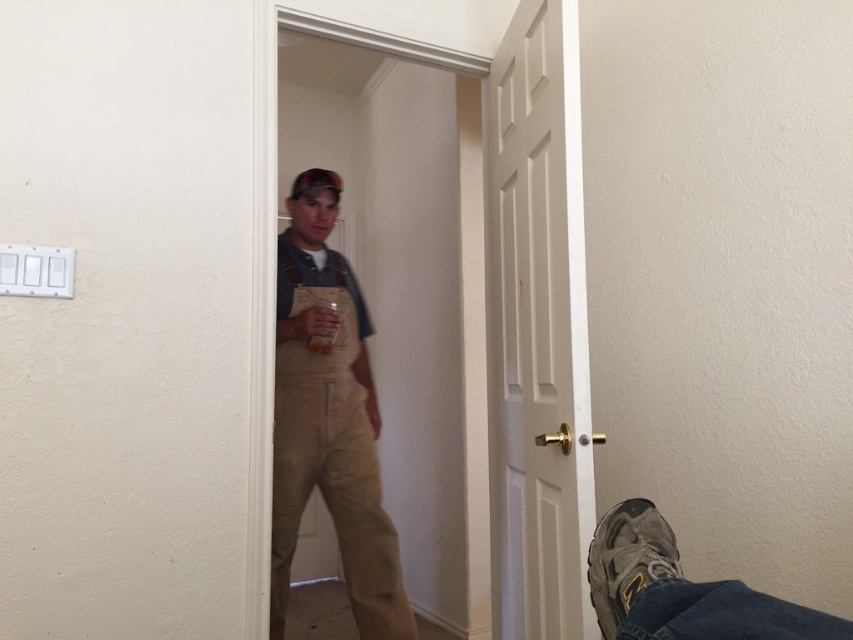
Looking at this image, is khaki overalls at center below brown suede shoe at lower right?

No, khaki overalls at center is not below brown suede shoe at lower right.

Can you confirm if khaki overalls at center is taller than brown suede shoe at lower right?

Yes, khaki overalls at center is taller than brown suede shoe at lower right.

Where is `khaki overalls at center`? Image resolution: width=853 pixels, height=640 pixels. khaki overalls at center is located at coordinates (328, 419).

Where is `khaki overalls at center`? khaki overalls at center is located at coordinates (328, 419).

Which is above, white matte door at center or brown suede shoe at lower right?

white matte door at center

Where is `white matte door at center`? white matte door at center is located at coordinates (538, 330).

Where is `white matte door at center`? The height and width of the screenshot is (640, 853). white matte door at center is located at coordinates (538, 330).

Where is `white matte door at center`? white matte door at center is located at coordinates (538, 330).

Is white matte door at center smaller than tan suede shoe at lower right?

No.

Between white matte door at center and tan suede shoe at lower right, which one has less height?

tan suede shoe at lower right

Is point (555, 200) more distant than point (614, 584)?

Yes, it is.

Locate an element on the screen. white matte door at center is located at coordinates (538, 330).